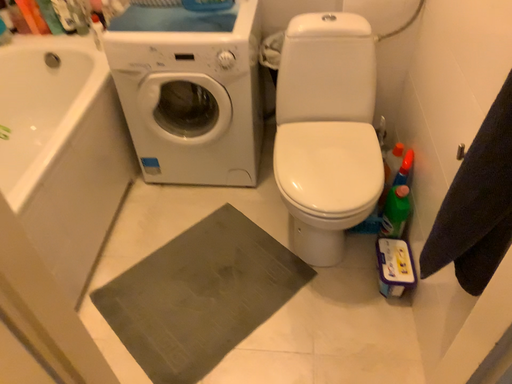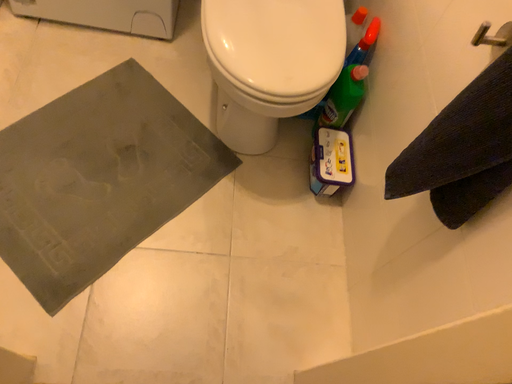
Question: Which way did the camera rotate in the video?

Choices:
 (A) rotated right
 (B) rotated left

Answer: (A)